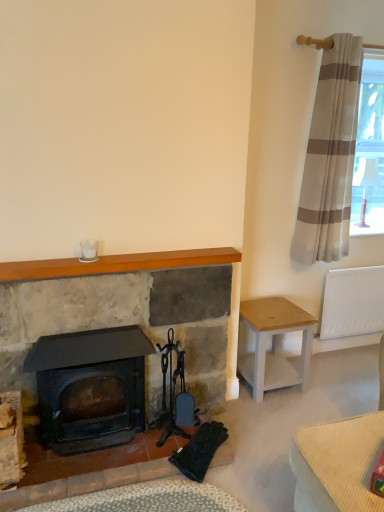
Where is `unoccupied area in front of white wood stool at right`? The width and height of the screenshot is (384, 512). unoccupied area in front of white wood stool at right is located at coordinates (272, 417).